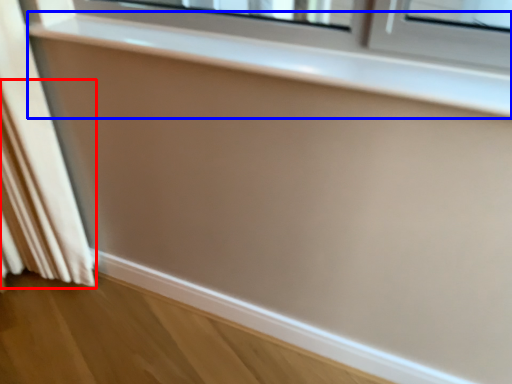
Question: Which object appears farthest to the camera in this image, curtain (highlighted by a red box) or window sill (highlighted by a blue box)?

Choices:
 (A) curtain
 (B) window sill

Answer: (A)